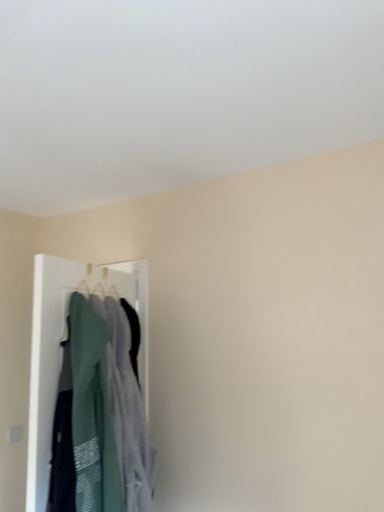
Image resolution: width=384 pixels, height=512 pixels. Describe the element at coordinates (100, 416) in the screenshot. I see `green fabric dress at left` at that location.

At what (x,y) coordinates should I click in order to perform the action: click on green fabric dress at left. Please return your answer as a coordinate pair (x, y). This screenshot has width=384, height=512. Looking at the image, I should click on (100, 416).

Image resolution: width=384 pixels, height=512 pixels. Find the location of `green fabric dress at left`. green fabric dress at left is located at coordinates (100, 416).